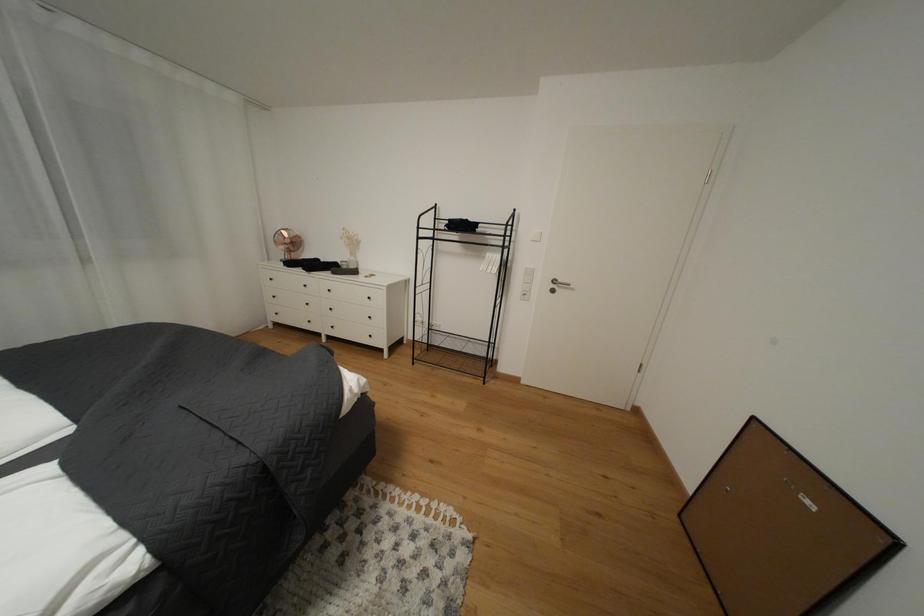
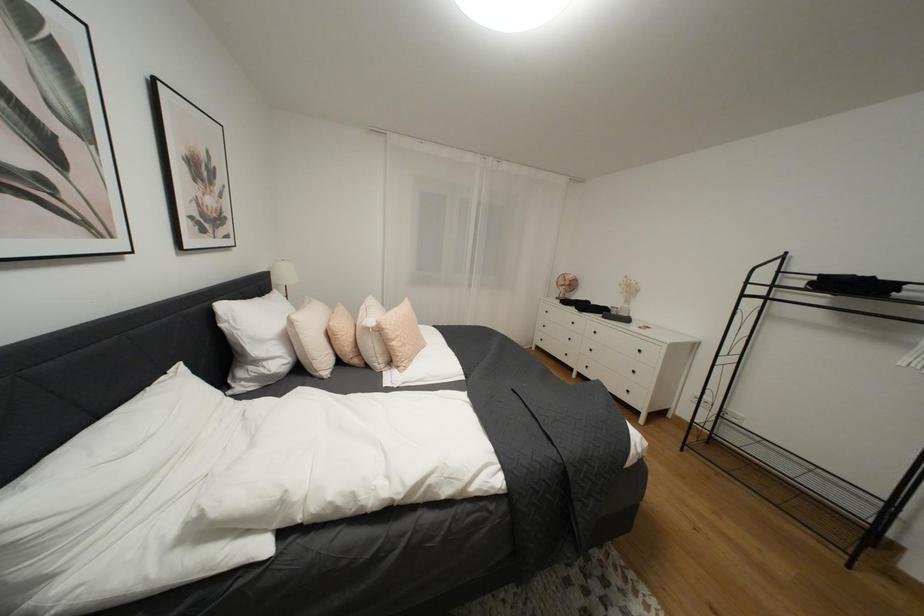
Question: Based on the continuous images, in which direction is the camera rotating? Reply with the corresponding letter.

Choices:
 (A) Left
 (B) Right
 (C) Up
 (D) Down

Answer: (A)